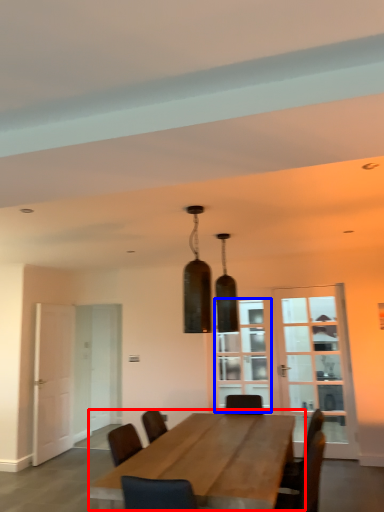
Question: Which point is further to the camera, table (highlighted by a red box) or window (highlighted by a blue box)?

Choices:
 (A) table
 (B) window

Answer: (B)